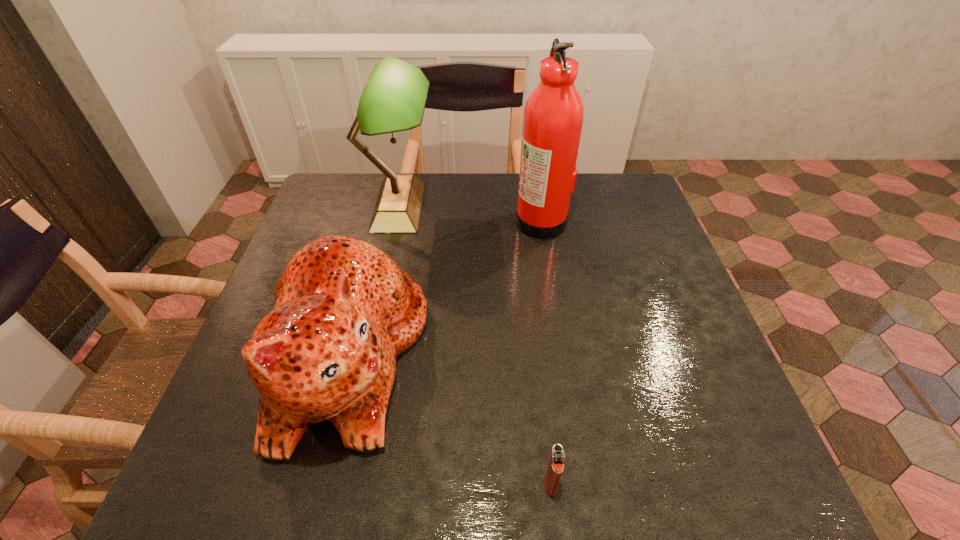
In order to click on the tallest object in this screenshot , I will do `click(553, 118)`.

The image size is (960, 540). Find the location of `table lamp`. table lamp is located at coordinates (394, 98).

Locate an element on the screen. The image size is (960, 540). the third farthest object is located at coordinates (344, 311).

You are a GUI agent. You are given a task and a screenshot of the screen. Output one action in this format:
    pyautogui.click(x=<x>, y=<y>)
    Task: Click on the cat
    This screenshot has height=540, width=960.
    Given the screenshot: What is the action you would take?
    pyautogui.click(x=344, y=311)

The image size is (960, 540). What are the coordinates of `the nearest object` in the screenshot? It's located at (555, 467).

You are a GUI agent. You are given a task and a screenshot of the screen. Output one action in this format:
    pyautogui.click(x=<x>, y=<y>)
    Task: Click on the shortest object
    This screenshot has width=960, height=540.
    Given the screenshot: What is the action you would take?
    pyautogui.click(x=555, y=467)

Identify the location of vacant space located on the label side of the fire extinguisher. (491, 220).

Locate an element on the screen. The height and width of the screenshot is (540, 960). vacant space located on the label side of the fire extinguisher is located at coordinates (423, 220).

The image size is (960, 540). Find the location of `vacant region located 0.220m on the label side of the fire extinguisher`. vacant region located 0.220m on the label side of the fire extinguisher is located at coordinates (440, 220).

At what (x,y) coordinates should I click in order to perform the action: click on free space located 0.270m on the metallic stand of the third shortest object. Please return your answer as a coordinate pair (x, y). The image size is (960, 540). Looking at the image, I should click on (523, 207).